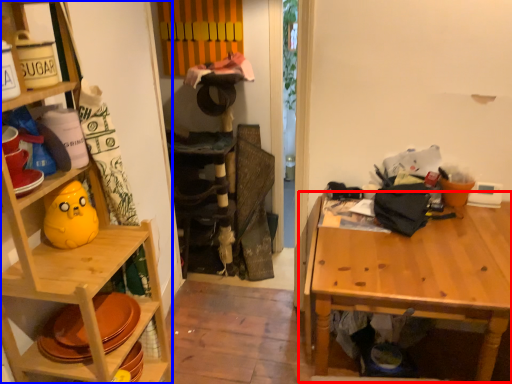
Question: Which of the following is the closest to the observer, table (highlighted by a red box) or shelf (highlighted by a blue box)?

Choices:
 (A) table
 (B) shelf

Answer: (B)